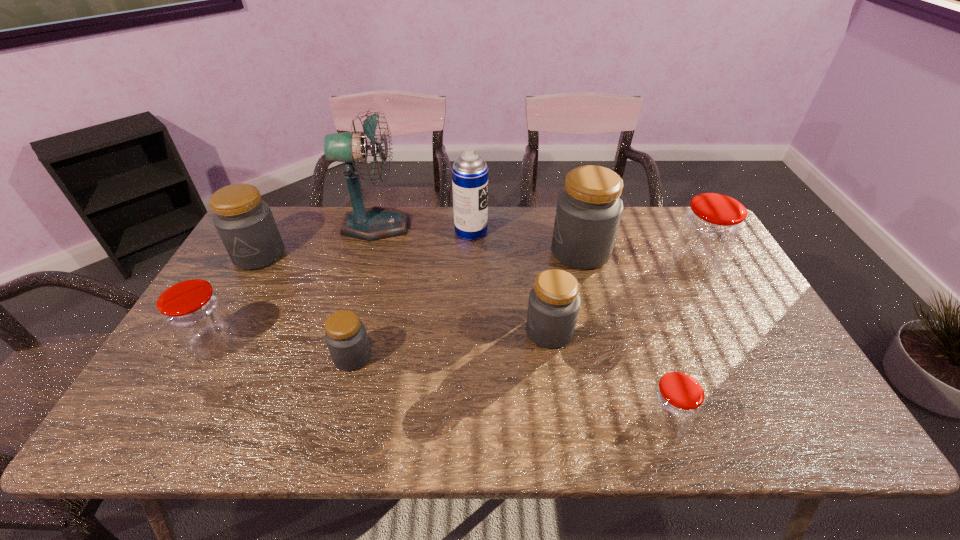
The image size is (960, 540). Find the location of `the second nearest red jar`. the second nearest red jar is located at coordinates (195, 314).

This screenshot has height=540, width=960. Identify the location of the smallest gray jar. (346, 337).

The height and width of the screenshot is (540, 960). In order to click on the third jar from left to right in this screenshot , I will do `click(346, 337)`.

Locate an element on the screen. the smallest red jar is located at coordinates (676, 400).

The image size is (960, 540). Identify the location of the second red jar from left to right. (676, 400).

This screenshot has height=540, width=960. Find the location of `free space located in front of the fan where the wind blows`. free space located in front of the fan where the wind blows is located at coordinates (496, 226).

This screenshot has width=960, height=540. In order to click on vacant point located on the label side of the fifth object from right to left in this screenshot , I will do `click(595, 231)`.

Identify the location of vacant region located on the surface of the biggest gray jar near the warning symbol. The image size is (960, 540). (471, 252).

Locate an element on the screen. The width and height of the screenshot is (960, 540). free space located 0.190m on the surface of the biggest gray jar near the warning symbol is located at coordinates (491, 252).

Locate an element on the screen. vacant position located 0.060m on the surface of the biggest gray jar near the warning symbol is located at coordinates (532, 252).